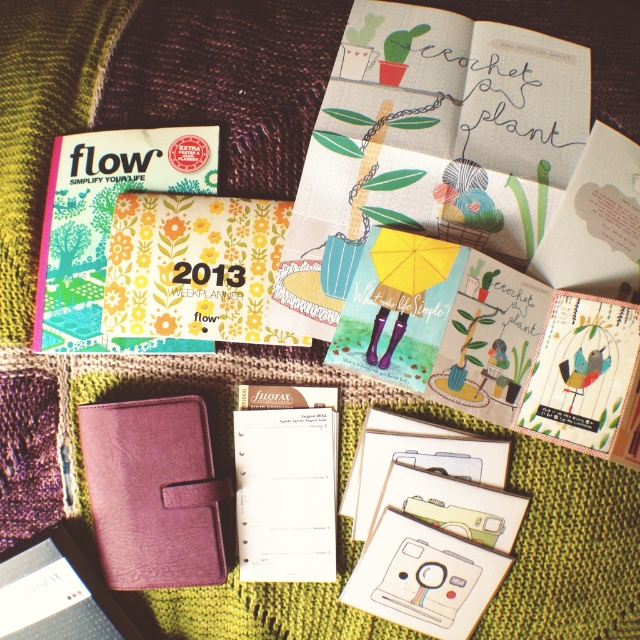
Is matte paper journal at upper center above purple leather notebook at center?

Yes, matte paper journal at upper center is above purple leather notebook at center.

Based on the photo, which is above, matte paper journal at upper center or purple leather notebook at center?

matte paper journal at upper center is above.

The height and width of the screenshot is (640, 640). What are the coordinates of `matte paper journal at upper center` in the screenshot? It's located at (429, 145).

Identify the location of matte paper journal at upper center. (429, 145).

Between matte paper journal at upper center and purple leather notepad at lower left, which one appears on the left side from the viewer's perspective?

purple leather notepad at lower left

Is matte paper journal at upper center bigger than purple leather notepad at lower left?

Yes.

Describe the element at coordinates (429, 145) in the screenshot. I see `matte paper journal at upper center` at that location.

At what (x,y) coordinates should I click in order to perform the action: click on matte paper journal at upper center. Please return your answer as a coordinate pair (x, y). This screenshot has height=640, width=640. Looking at the image, I should click on (429, 145).

Between purple leather notepad at lower left and purple leather notebook at center, which one appears on the right side from the viewer's perspective?

From the viewer's perspective, purple leather notebook at center appears more on the right side.

Does purple leather notepad at lower left appear on the right side of purple leather notebook at center?

In fact, purple leather notepad at lower left is to the left of purple leather notebook at center.

Locate an element on the screen. purple leather notepad at lower left is located at coordinates (154, 492).